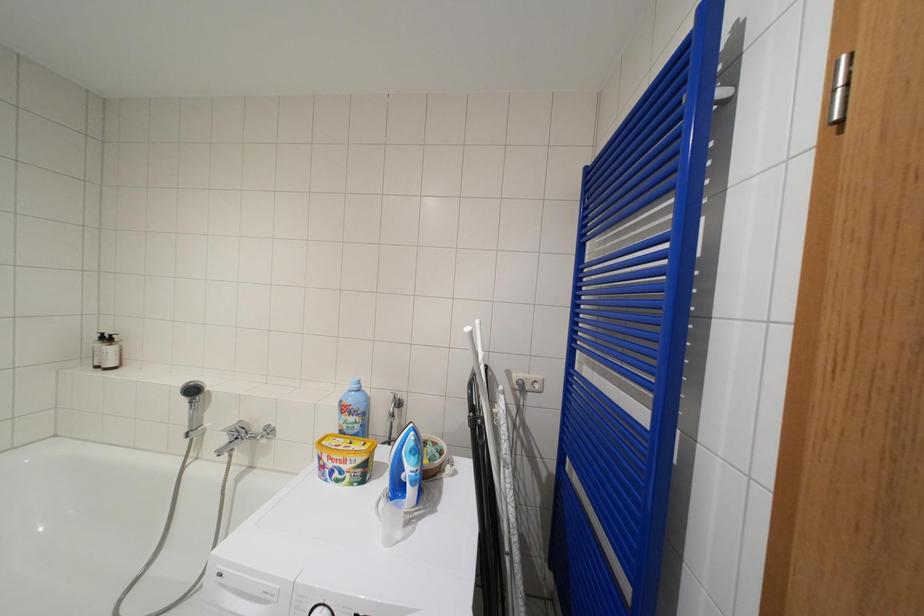
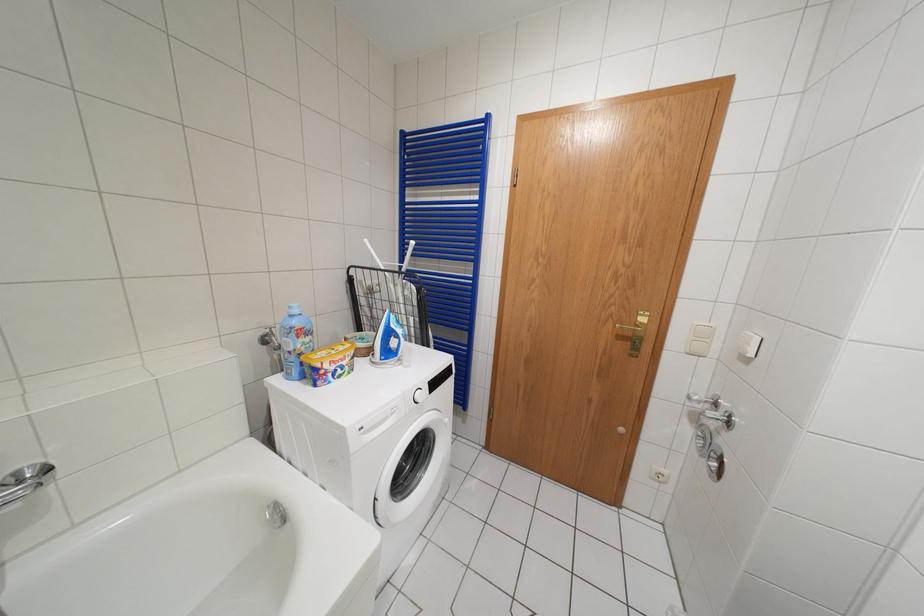
How did the camera likely rotate?

The rotation direction of the camera is right-down.